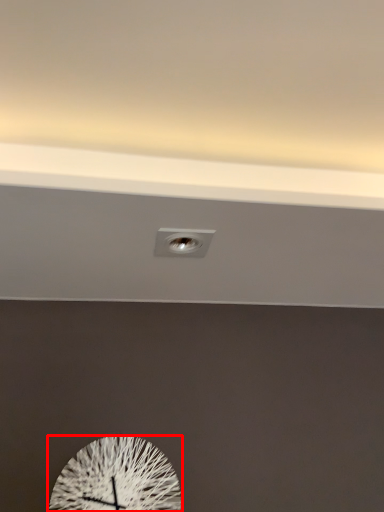
Question: From the image, what is the correct spatial relationship of wall clock (annotated by the red box) in relation to electric outlet?

Choices:
 (A) right
 (B) left

Answer: (B)